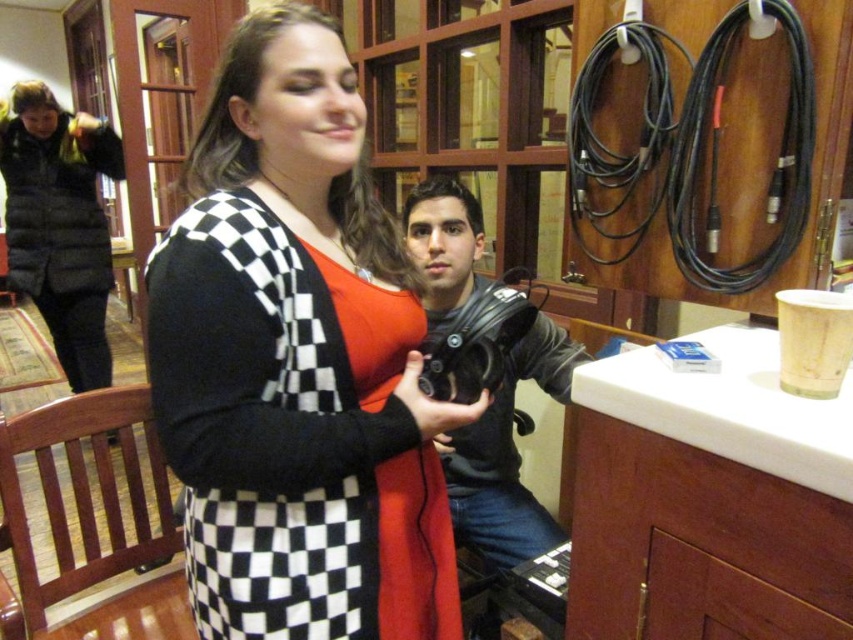
Question: Which point is closer to the camera?

Choices:
 (A) white matte counter top at right
 (B) black checkered sweater at center
 (C) matte black camera at center

Answer: (A)

Question: Which object is closer to the camera taking this photo?

Choices:
 (A) black puffer vest at left
 (B) black checkered sweater at center
 (C) matte black camera at center

Answer: (B)

Question: Is white matte counter top at right above black puffer vest at left?

Choices:
 (A) yes
 (B) no

Answer: (B)

Question: Does black checkered sweater at center appear on the right side of black puffer vest at left?

Choices:
 (A) no
 (B) yes

Answer: (B)

Question: Does white matte counter top at right appear under matte black camera at center?

Choices:
 (A) no
 (B) yes

Answer: (B)

Question: Among these points, which one is nearest to the camera?

Choices:
 (A) (102, 342)
 (B) (466, 253)

Answer: (B)